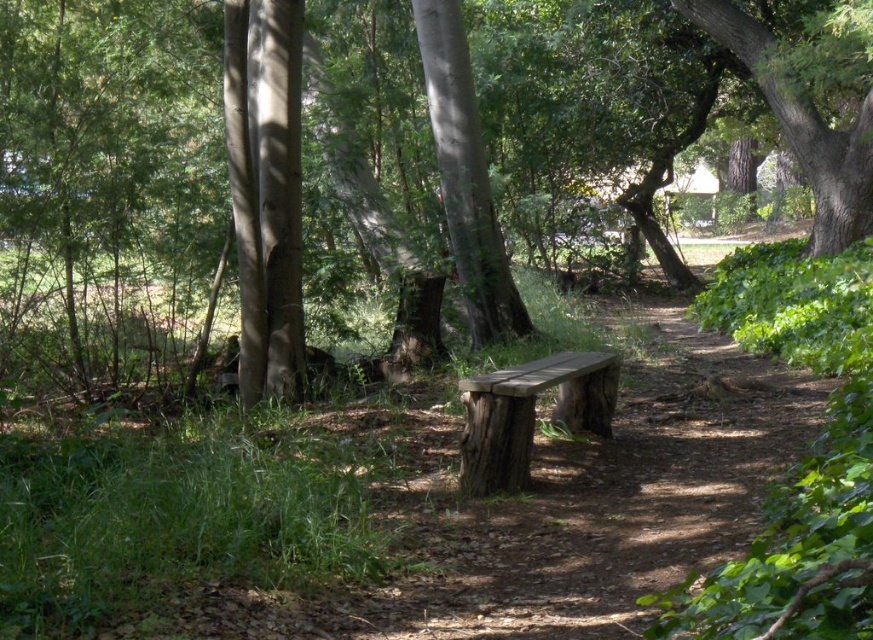
You are planning to take a nap on the wooden bench at center. Considering the green rough bark tree at upper right, will you be able to lie down fully on the bench without any part of your body extending beyond the bench?

The green rough bark tree at upper right is much taller than the wooden bench at center, so lying down fully on the wooden bench at center would not be affected by the tree height. However, the bench itself has a flat seat and backrest, so you should be able to lie down fully without any part of your body extending beyond the bench.

You are planning to carve a small wooden plaque. You need a piece of wood that is at least 30 cm wide. You have access to the smooth bark tree at center and the green rough bark tree at upper right. Which tree should you choose to ensure you get a wide enough piece of wood?

The green rough bark tree at upper right has a larger width than the smooth bark tree at center, so you should choose the green rough bark tree at upper right to ensure you get a wide enough piece of wood.

You are a hiker who wants to measure the distance between the green rough bark tree at upper right and the wooden bench at center. You have a 30 feet long rope. Can you determine if the rope is sufficient to reach both objects without any extension?

The distance between the green rough bark tree at upper right and the wooden bench at center is 31.61 feet. Since the rope is only 30 feet long, it is not sufficient to cover the entire distance between them.